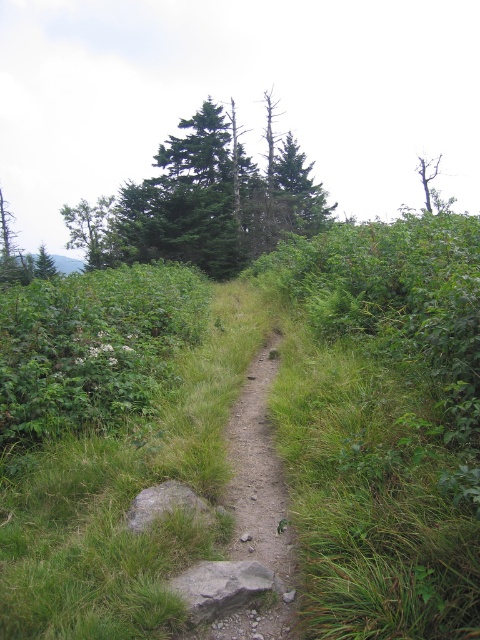
Between green matte tree at upper center and dirt path at center, which one has more height?

Standing taller between the two is green matte tree at upper center.

Does green matte tree at upper center have a lesser height compared to dirt path at center?

No.

Who is more distant from viewer, (207, 195) or (284, 621)?

Positioned behind is point (207, 195).

This screenshot has height=640, width=480. Identify the location of green matte tree at upper center. (203, 204).

Can you confirm if dirt path at center is positioned to the left of green leafy tree at upper right?

Correct, you'll find dirt path at center to the left of green leafy tree at upper right.

The height and width of the screenshot is (640, 480). What do you see at coordinates (259, 508) in the screenshot?
I see `dirt path at center` at bounding box center [259, 508].

Locate an element on the screen. This screenshot has width=480, height=640. dirt path at center is located at coordinates (259, 508).

Can you confirm if green matte tree at upper center is taller than green leafy tree at upper right?

No, green matte tree at upper center is not taller than green leafy tree at upper right.

Who is shorter, green matte tree at upper center or green leafy tree at upper right?

green matte tree at upper center

Does point (140, 227) come behind point (434, 164)?

No, it is in front of (434, 164).

Locate an element on the screen. The height and width of the screenshot is (640, 480). green matte tree at upper center is located at coordinates (203, 204).